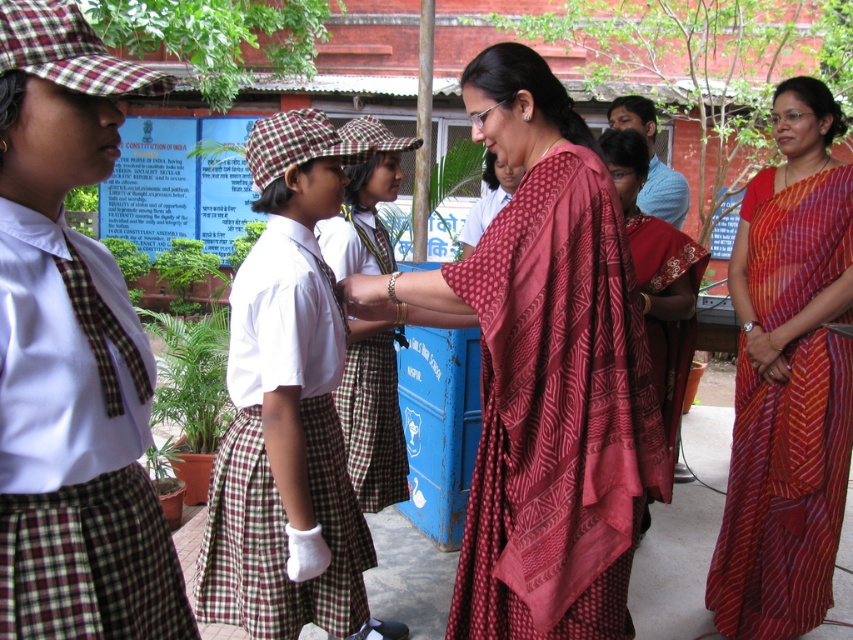
Find the location of `red striped sari at center`. red striped sari at center is located at coordinates (788, 380).

You are a GUI agent. You are given a task and a screenshot of the screen. Output one action in this format:
    pyautogui.click(x=<x>, y=<y>)
    Task: Click on the red striped sari at center
    
    Given the screenshot: What is the action you would take?
    pyautogui.click(x=788, y=380)

Is red striped sari at center shorter than checkered fabric dress at center?

Incorrect, red striped sari at center's height does not fall short of checkered fabric dress at center's.

Find the location of a particular element. red striped sari at center is located at coordinates (788, 380).

Who is more distant from viewer, (10, 316) or (775, 205)?

Point (775, 205)

Who is positioned more to the left, matte plaid uniform at center or red striped sari at center?

From the viewer's perspective, matte plaid uniform at center appears more on the left side.

Is point (0, 317) closer to camera compared to point (822, 561)?

Yes, it is.

Locate an element on the screen. The height and width of the screenshot is (640, 853). matte plaid uniform at center is located at coordinates (71, 355).